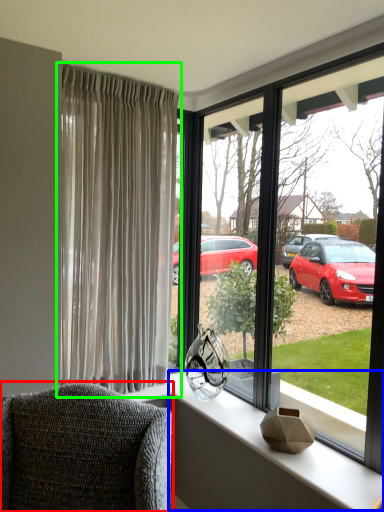
Question: Which is nearer to the chair (highlighted by a red box)? window sill (highlighted by a blue box) or curtain (highlighted by a green box).

Choices:
 (A) window sill
 (B) curtain

Answer: (A)